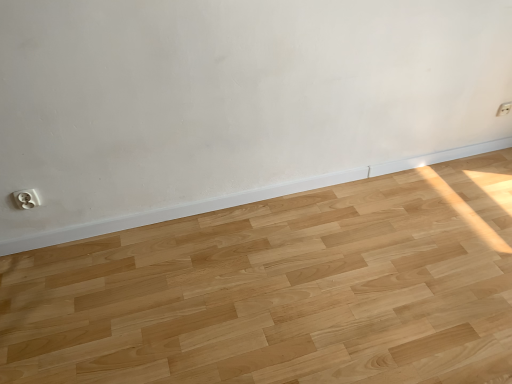
What do you see at coordinates (26, 199) in the screenshot? The image size is (512, 384). I see `white plastic electric outlet at lower left, which is the 2th electric outlet from back to front` at bounding box center [26, 199].

What are the coordinates of `white plastic electric outlet at lower left, which appears as the 1th electric outlet when viewed from the front` in the screenshot? It's located at (26, 199).

How much space does white plastic electric outlet at upper right, acting as the 2th electric outlet starting from the bottom, occupy horizontally?

The width of white plastic electric outlet at upper right, acting as the 2th electric outlet starting from the bottom, is 0.65 inches.

I want to click on white plastic electric outlet at upper right, acting as the 1th electric outlet starting from the back, so click(x=504, y=109).

The image size is (512, 384). Describe the element at coordinates (504, 109) in the screenshot. I see `white plastic electric outlet at upper right, acting as the 2th electric outlet starting from the bottom` at that location.

Where is `white plastic electric outlet at lower left, which appears as the 1th electric outlet when viewed from the front`? The height and width of the screenshot is (384, 512). white plastic electric outlet at lower left, which appears as the 1th electric outlet when viewed from the front is located at coordinates (26, 199).

Is white plastic electric outlet at upper right, which ranks as the first electric outlet in top-to-bottom order, at the left side of white plastic electric outlet at lower left, which is counted as the 1th electric outlet, starting from the bottom?

In fact, white plastic electric outlet at upper right, which ranks as the first electric outlet in top-to-bottom order, is to the right of white plastic electric outlet at lower left, which is counted as the 1th electric outlet, starting from the bottom.

Is the position of white plastic electric outlet at upper right, arranged as the 2th electric outlet when viewed from the front, more distant than that of white plastic electric outlet at lower left, which is counted as the 1th electric outlet, starting from the bottom?

Yes, it is behind white plastic electric outlet at lower left, which is counted as the 1th electric outlet, starting from the bottom.

Does point (508, 106) appear closer or farther from the camera than point (26, 191)?

Point (508, 106).

From the image's perspective, is white plastic electric outlet at upper right, positioned as the 1th electric outlet in right-to-left order, above or below white plastic electric outlet at lower left, the first electric outlet viewed from the left?

Clearly, from the image's perspective, white plastic electric outlet at upper right, positioned as the 1th electric outlet in right-to-left order, is above white plastic electric outlet at lower left, the first electric outlet viewed from the left.

From a real-world perspective, relative to white plastic electric outlet at lower left, which appears as the 1th electric outlet when viewed from the front, is white plastic electric outlet at upper right, which ranks as the first electric outlet in top-to-bottom order, vertically above or below?

From a real-world perspective, white plastic electric outlet at upper right, which ranks as the first electric outlet in top-to-bottom order, is physically below white plastic electric outlet at lower left, which appears as the 1th electric outlet when viewed from the front.

Between white plastic electric outlet at upper right, arranged as the 2th electric outlet when viewed from the front, and white plastic electric outlet at lower left, the 2th electric outlet when ordered from right to left, which one has smaller width?

white plastic electric outlet at upper right, arranged as the 2th electric outlet when viewed from the front.

Does white plastic electric outlet at upper right, acting as the 2th electric outlet starting from the bottom, have a greater height compared to white plastic electric outlet at lower left, the first electric outlet viewed from the left?

No.

Which of these two, white plastic electric outlet at upper right, arranged as the 2th electric outlet when viewed from the front, or white plastic electric outlet at lower left, which appears as the 1th electric outlet when viewed from the front, is smaller?

white plastic electric outlet at upper right, arranged as the 2th electric outlet when viewed from the front.

Is white plastic electric outlet at lower left, which is counted as the 1th electric outlet, starting from the bottom, located within white plastic electric outlet at upper right, positioned as the 1th electric outlet in right-to-left order?

No, white plastic electric outlet at lower left, which is counted as the 1th electric outlet, starting from the bottom, is not surrounded by white plastic electric outlet at upper right, positioned as the 1th electric outlet in right-to-left order.

Does white plastic electric outlet at upper right, which ranks as the first electric outlet in top-to-bottom order, touch white plastic electric outlet at lower left, which is the 2th electric outlet from back to front?

No, white plastic electric outlet at upper right, which ranks as the first electric outlet in top-to-bottom order, is not with white plastic electric outlet at lower left, which is the 2th electric outlet from back to front.

Is white plastic electric outlet at upper right, positioned as the 1th electric outlet in right-to-left order, oriented away from white plastic electric outlet at lower left, which is counted as the 1th electric outlet, starting from the bottom?

No, white plastic electric outlet at lower left, which is counted as the 1th electric outlet, starting from the bottom, is not at the back of white plastic electric outlet at upper right, positioned as the 1th electric outlet in right-to-left order.

How many degrees apart are the facing directions of white plastic electric outlet at upper right, acting as the 2th electric outlet starting from the bottom, and white plastic electric outlet at lower left, the 2th electric outlet when ordered from right to left?

white plastic electric outlet at upper right, acting as the 2th electric outlet starting from the bottom, and white plastic electric outlet at lower left, the 2th electric outlet when ordered from right to left, are facing 0.00171 degrees away from each other.

Measure the distance between white plastic electric outlet at upper right, acting as the 1th electric outlet starting from the back, and white plastic electric outlet at lower left, the 2th electric outlet when ordered from right to left.

A distance of 2.21 meters exists between white plastic electric outlet at upper right, acting as the 1th electric outlet starting from the back, and white plastic electric outlet at lower left, the 2th electric outlet when ordered from right to left.

Locate an element on the screen. The image size is (512, 384). electric outlet in front of the white plastic electric outlet at upper right, arranged as the 2th electric outlet when viewed from the front is located at coordinates (26, 199).

Does white plastic electric outlet at lower left, the first electric outlet viewed from the left, appear on the right side of white plastic electric outlet at upper right, arranged as the 2th electric outlet when viewed from the front?

No, white plastic electric outlet at lower left, the first electric outlet viewed from the left, is not to the right of white plastic electric outlet at upper right, arranged as the 2th electric outlet when viewed from the front.

Is white plastic electric outlet at lower left, which is the 2th electric outlet from back to front, in front of or behind white plastic electric outlet at upper right, acting as the 1th electric outlet starting from the back, in the image?

Visually, white plastic electric outlet at lower left, which is the 2th electric outlet from back to front, is located in front of white plastic electric outlet at upper right, acting as the 1th electric outlet starting from the back.

Between point (27, 208) and point (505, 106), which one is positioned behind?

Positioned behind is point (505, 106).

From the image's perspective, is white plastic electric outlet at lower left, the 2th electric outlet when ordered from right to left, located above white plastic electric outlet at upper right, acting as the 1th electric outlet starting from the back?

Actually, white plastic electric outlet at lower left, the 2th electric outlet when ordered from right to left, appears below white plastic electric outlet at upper right, acting as the 1th electric outlet starting from the back, in the image.

From a real-world perspective, which is physically below, white plastic electric outlet at lower left, which is counted as the 1th electric outlet, starting from the bottom, or white plastic electric outlet at upper right, placed as the 2th electric outlet when sorted from left to right?

white plastic electric outlet at upper right, placed as the 2th electric outlet when sorted from left to right, from a real-world perspective.

Between white plastic electric outlet at lower left, which appears as the 1th electric outlet when viewed from the front, and white plastic electric outlet at upper right, arranged as the 2th electric outlet when viewed from the front, which one has smaller width?

white plastic electric outlet at upper right, arranged as the 2th electric outlet when viewed from the front, is thinner.

Considering the sizes of objects white plastic electric outlet at lower left, which is the 2th electric outlet from back to front, and white plastic electric outlet at upper right, acting as the 2th electric outlet starting from the bottom, in the image provided, who is taller, white plastic electric outlet at lower left, which is the 2th electric outlet from back to front, or white plastic electric outlet at upper right, acting as the 2th electric outlet starting from the bottom,?

Standing taller between the two is white plastic electric outlet at lower left, which is the 2th electric outlet from back to front.

Between white plastic electric outlet at lower left, acting as the 2th electric outlet starting from the top, and white plastic electric outlet at upper right, which ranks as the first electric outlet in top-to-bottom order, which one has smaller size?

Smaller between the two is white plastic electric outlet at upper right, which ranks as the first electric outlet in top-to-bottom order.

Would you say white plastic electric outlet at lower left, which appears as the 1th electric outlet when viewed from the front, contains white plastic electric outlet at upper right, positioned as the 1th electric outlet in right-to-left order?

Actually, white plastic electric outlet at upper right, positioned as the 1th electric outlet in right-to-left order, is outside white plastic electric outlet at lower left, which appears as the 1th electric outlet when viewed from the front.

Is white plastic electric outlet at lower left, the first electric outlet viewed from the left, in contact with white plastic electric outlet at upper right, arranged as the 2th electric outlet when viewed from the front?

They are not placed beside each other.

Is white plastic electric outlet at lower left, which is counted as the 1th electric outlet, starting from the bottom, looking in the opposite direction of white plastic electric outlet at upper right, acting as the 1th electric outlet starting from the back?

No, white plastic electric outlet at lower left, which is counted as the 1th electric outlet, starting from the bottom,'s orientation is not away from white plastic electric outlet at upper right, acting as the 1th electric outlet starting from the back.

In the scene shown: What's the angular difference between white plastic electric outlet at lower left, which is counted as the 1th electric outlet, starting from the bottom, and white plastic electric outlet at upper right, acting as the 2th electric outlet starting from the bottom,'s facing directions?

The angular difference between white plastic electric outlet at lower left, which is counted as the 1th electric outlet, starting from the bottom, and white plastic electric outlet at upper right, acting as the 2th electric outlet starting from the bottom, is 0.00171 degrees.

You are a GUI agent. You are given a task and a screenshot of the screen. Output one action in this format:
    pyautogui.click(x=<x>, y=<y>)
    Task: Click on the electric outlet that is above the white plastic electric outlet at upper right, placed as the 2th electric outlet when sorted from left to right (from a real-world perspective)
    The width and height of the screenshot is (512, 384).
    Given the screenshot: What is the action you would take?
    pyautogui.click(x=26, y=199)

Where is `electric outlet behind the white plastic electric outlet at lower left, the first electric outlet viewed from the left`? This screenshot has width=512, height=384. electric outlet behind the white plastic electric outlet at lower left, the first electric outlet viewed from the left is located at coordinates (504, 109).

Locate an element on the screen. The height and width of the screenshot is (384, 512). electric outlet lying in front of the white plastic electric outlet at upper right, arranged as the 2th electric outlet when viewed from the front is located at coordinates (26, 199).